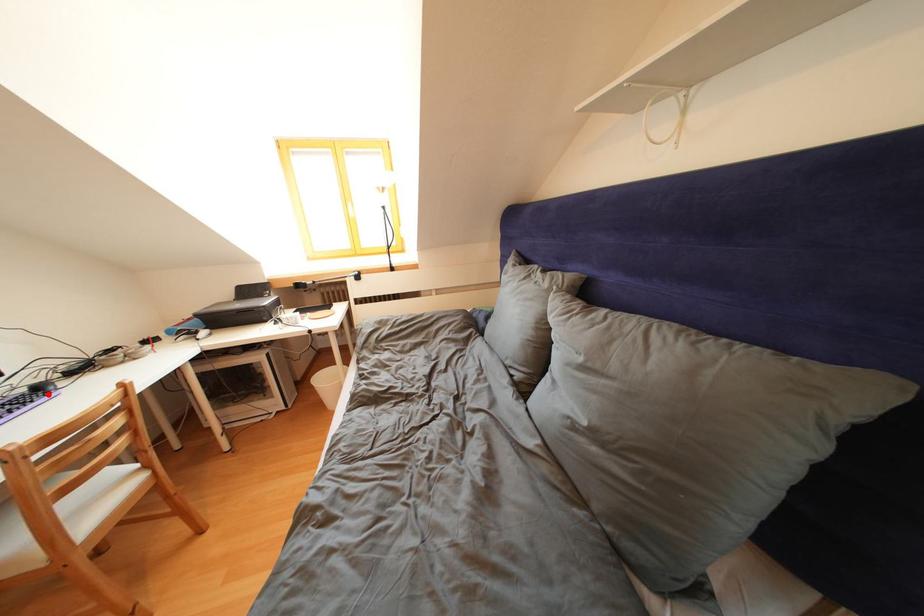
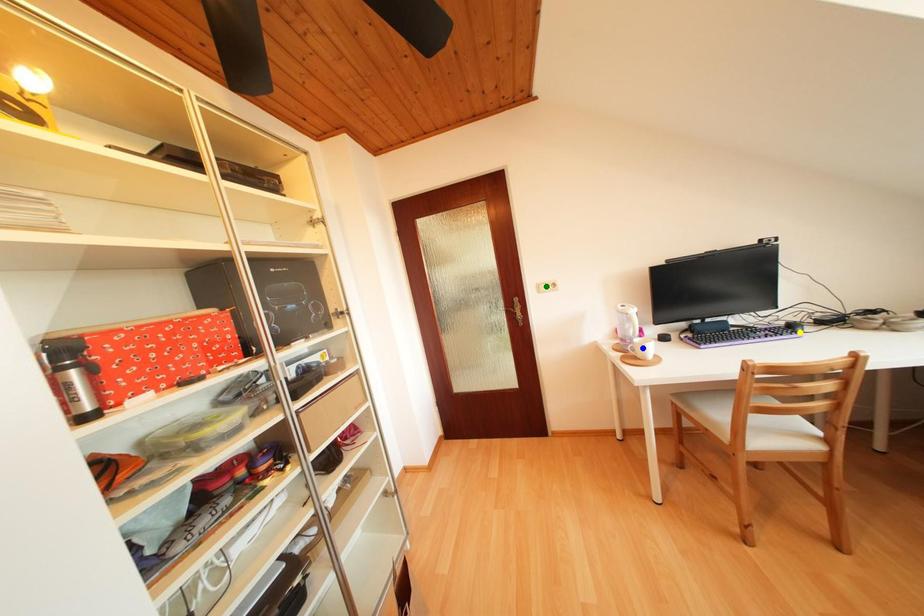
Question: I am providing you with two images of the same scene from different viewpoints. A red point is marked on the first image. You are given multiple points on the second image. Which point in image 2 is actually the same real-world point as the red point in image 1?

Choices:
 (A) yellow point
 (B) blue point
 (C) green point

Answer: (A)